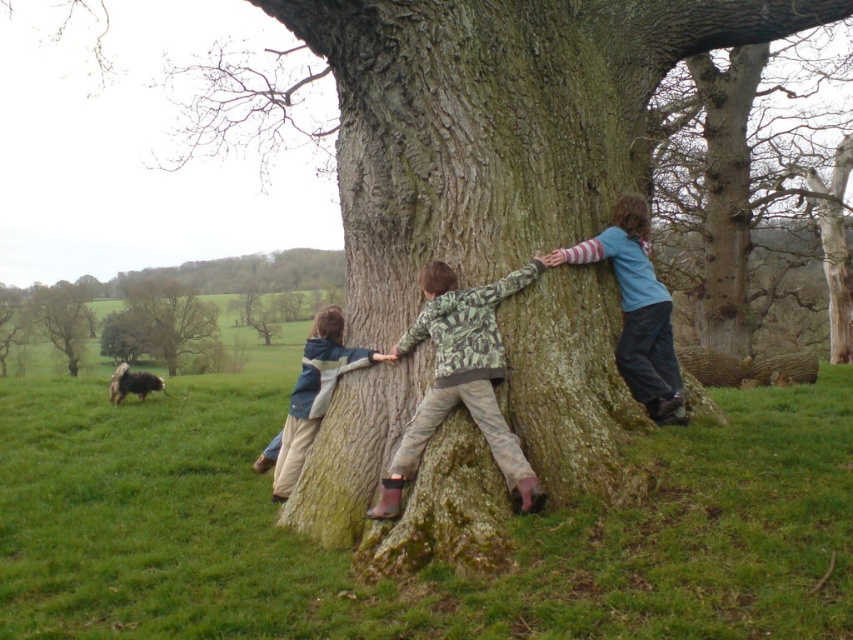
You are standing at the base of the large tree in the grassy field. There are two points marked in the image. The first point is at coordinates point (187, 344) and the second point is at point (90, 323). Which point is closer to you?

Point (187, 344) is in front of point (90, 323), so it is closer to you.

You are a photographer trying to capture a photo of the green mossy tree trunk at lower left and the camouflage jacket at lower left. Since you want to focus on the tree trunk, which object should you zoom in on more?

The green mossy tree trunk at lower left is bigger than the camouflage jacket at lower left, so you should zoom in on the green mossy tree trunk at lower left to focus on it properly.

You are trying to decide which tree trunk to hug for a group photo. The green mossy tree trunk at lower left and the smooth bark tree at left are both options. Based on their widths, which one do you think can fit more people hugging it comfortably?

The green mossy tree trunk at lower left might be wider than smooth bark tree at left, so it can fit more people hugging it comfortably.